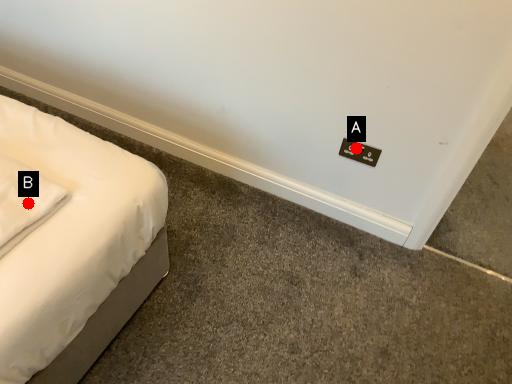
Question: Two points are circled on the image, labeled by A and B beside each circle. Which point appears farthest from the camera in this image?

Choices:
 (A) A is further
 (B) B is further

Answer: (A)